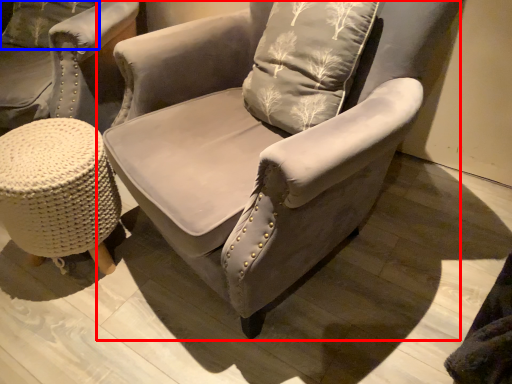
Question: Which object appears closest to the camera in this image, chair (highlighted by a red box) or pillow (highlighted by a blue box)?

Choices:
 (A) chair
 (B) pillow

Answer: (A)